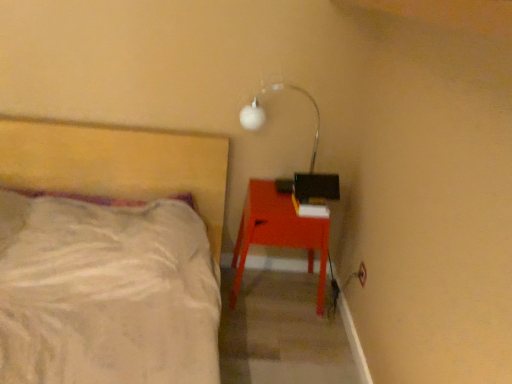
Question: From the image's perspective, is matte red desk at right above or below white glossy lamp at upper right?

Choices:
 (A) below
 (B) above

Answer: (A)

Question: Is matte red desk at right situated inside white glossy lamp at upper right or outside?

Choices:
 (A) inside
 (B) outside

Answer: (B)

Question: From their relative heights in the image, would you say matte red desk at right is taller or shorter than white glossy lamp at upper right?

Choices:
 (A) tall
 (B) short

Answer: (A)

Question: Is white glossy lamp at upper right spatially inside matte red desk at right, or outside of it?

Choices:
 (A) inside
 (B) outside

Answer: (B)

Question: From the image's perspective, relative to matte red desk at right, is white glossy lamp at upper right above or below?

Choices:
 (A) above
 (B) below

Answer: (A)

Question: Would you say white glossy lamp at upper right is to the left or to the right of matte red desk at right in the picture?

Choices:
 (A) right
 (B) left

Answer: (A)

Question: Does point (317, 110) appear closer or farther from the camera than point (282, 226)?

Choices:
 (A) closer
 (B) farther

Answer: (B)